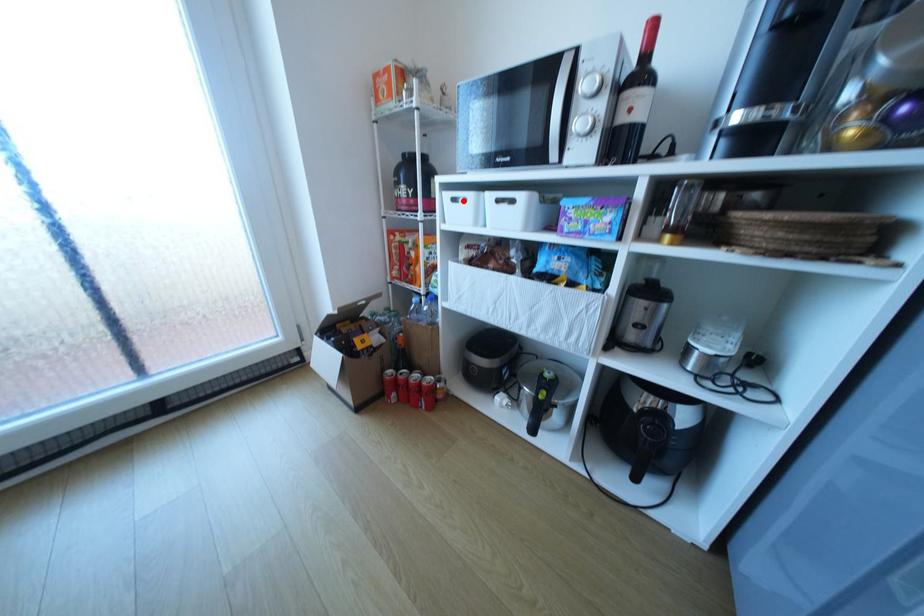
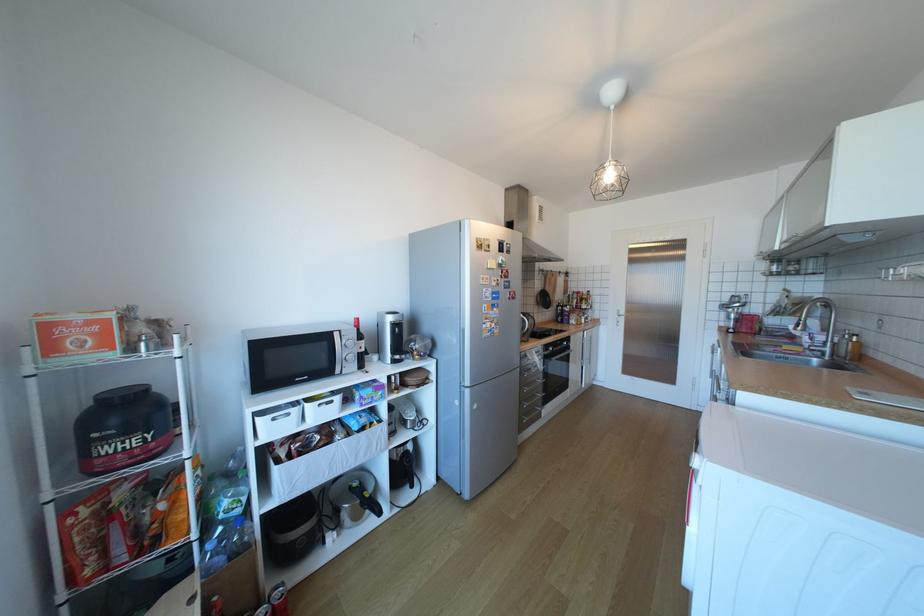
The point at the highlighted location is marked in the first image. Where is the corresponding point in the second image?

(283, 419)